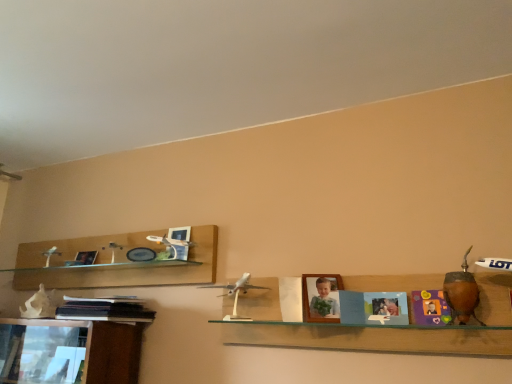
Question: From a real-world perspective, is matte plastic picture frame at upper left, which is counted as the first picture frame, starting from the left, positioned under white plastic airplane at center based on gravity?

Choices:
 (A) yes
 (B) no

Answer: (B)

Question: Considering the relative positions of matte plastic picture frame at upper left, the 1th picture frame in the back-to-front sequence, and white plastic airplane at center in the image provided, is matte plastic picture frame at upper left, the 1th picture frame in the back-to-front sequence, to the left of white plastic airplane at center from the viewer's perspective?

Choices:
 (A) yes
 (B) no

Answer: (A)

Question: Is there a large distance between matte plastic picture frame at upper left, which is counted as the first picture frame, starting from the left, and white plastic airplane at center?

Choices:
 (A) no
 (B) yes

Answer: (B)

Question: From the image's perspective, is matte plastic picture frame at upper left, which is the 2th picture frame from right to left, above white plastic airplane at center?

Choices:
 (A) no
 (B) yes

Answer: (B)

Question: Is matte plastic picture frame at upper left, which is the 2th picture frame from right to left, taller than white plastic airplane at center?

Choices:
 (A) no
 (B) yes

Answer: (A)

Question: Does matte plastic picture frame at upper left, the 1th picture frame in the back-to-front sequence, have a lesser width compared to white plastic airplane at center?

Choices:
 (A) yes
 (B) no

Answer: (A)

Question: Is white plastic airplane at center not inside silver metallic airplane at center, acting as the second toy starting from the right?

Choices:
 (A) yes
 (B) no

Answer: (A)

Question: Is white plastic airplane at center facing away from silver metallic airplane at center, which ranks as the 2th toy in front-to-back order?

Choices:
 (A) no
 (B) yes

Answer: (B)

Question: Is white plastic airplane at center far away from silver metallic airplane at center, acting as the second toy starting from the right?

Choices:
 (A) yes
 (B) no

Answer: (B)

Question: Is white plastic airplane at center oriented towards silver metallic airplane at center, which is the 1th toy from left to right?

Choices:
 (A) yes
 (B) no

Answer: (A)

Question: Is the depth of white plastic airplane at center greater than that of silver metallic airplane at center, acting as the second toy starting from the right?

Choices:
 (A) no
 (B) yes

Answer: (A)

Question: Can you confirm if white plastic airplane at center is positioned to the left of silver metallic airplane at center, acting as the second toy starting from the right?

Choices:
 (A) no
 (B) yes

Answer: (A)

Question: Can you see matte plastic picture frame at upper left, positioned as the second picture frame in front-to-back order, touching silver metallic airplane at center, which is the 1th toy from left to right?

Choices:
 (A) no
 (B) yes

Answer: (A)